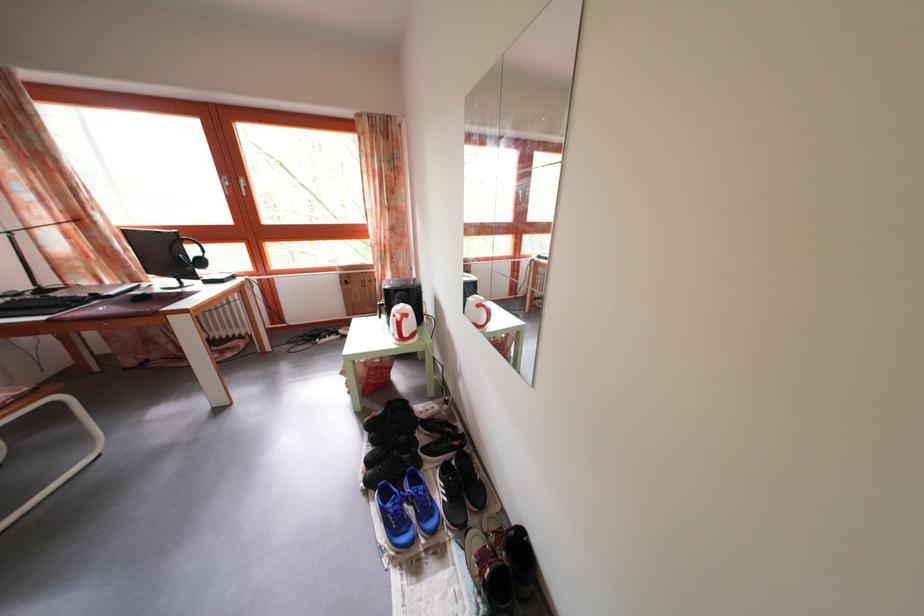
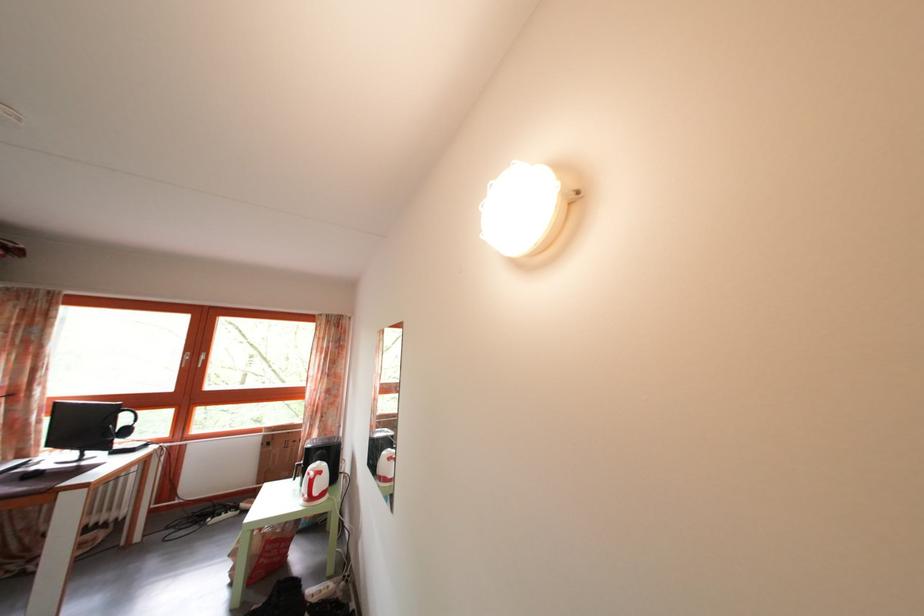
The point at (414, 323) is marked in the first image. Where is the corresponding point in the second image?

(327, 480)